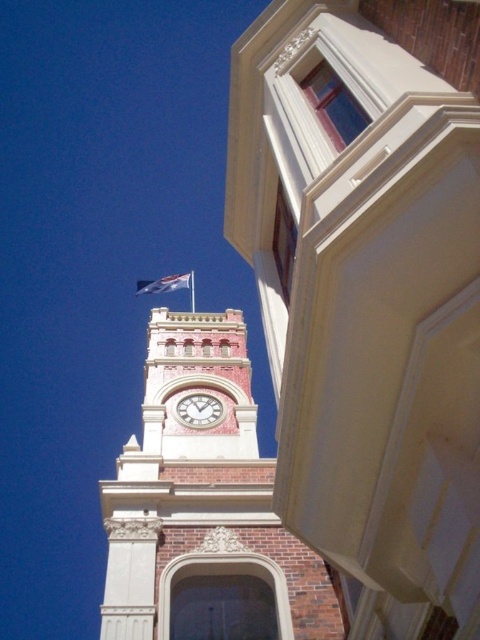
You are an architect analyzing the historic building. You notice the matte pink clock at center and the white fabric flag at upper center. Which object has a greater width when viewed from your perspective?

The white fabric flag at upper center has a greater width than the matte pink clock at center, as the matte pink clock at center is thinner than the white fabric flag at upper center.

You are standing in front of the historic building and notice the brick clock tower at center and the white fabric flag at upper center. Which object is closer to you?

The brick clock tower at center is closer to you because it is in front of the white fabric flag at upper center.

You are standing in front of the historic building and notice the matte pink clock at center and the white fabric flag at upper center. Which object is positioned to the right of the other?

The matte pink clock at center is to the right of white fabric flag at upper center.